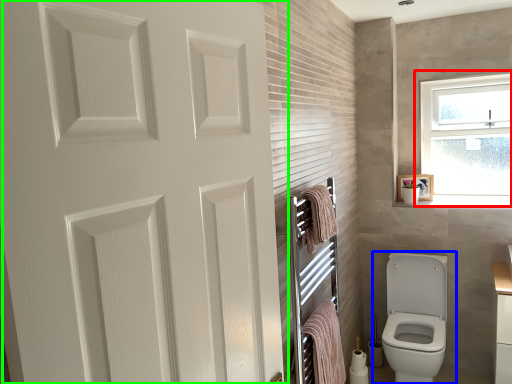
Question: Estimate the real-world distances between objects in this image. Which object is farther from window (highlighted by a red box), toilet (highlighted by a blue box) or door (highlighted by a green box)?

Choices:
 (A) toilet
 (B) door

Answer: (B)